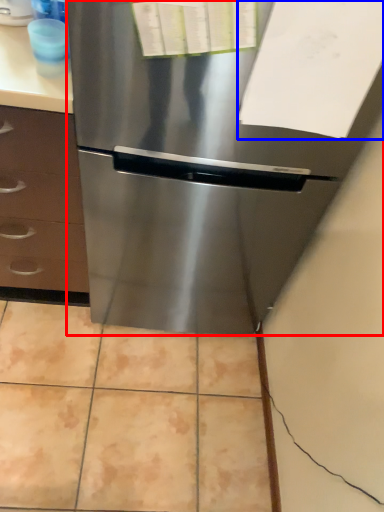
Question: Which object is closer to the camera taking this photo, refrigerator (highlighted by a red box) or paper (highlighted by a blue box)?

Choices:
 (A) refrigerator
 (B) paper

Answer: (A)